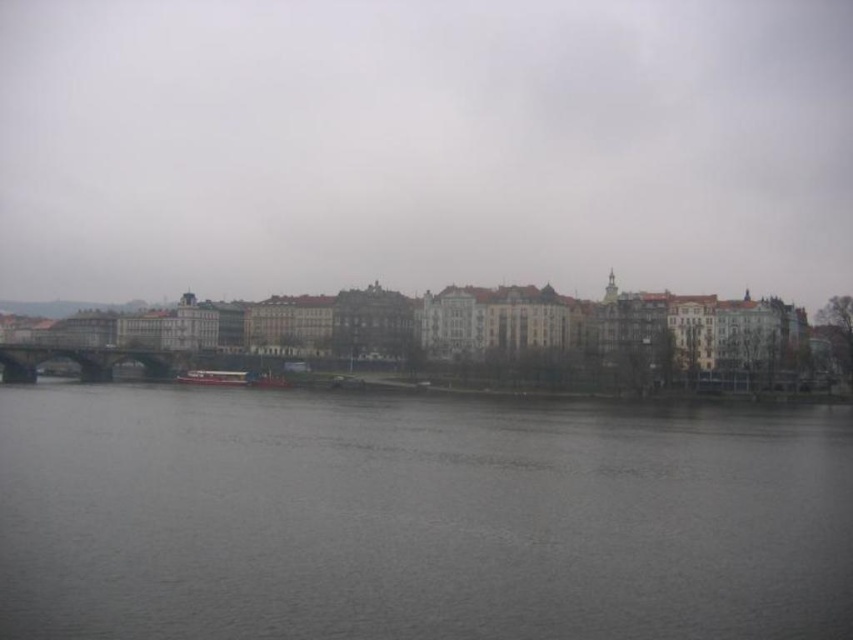
Question: Among these objects, which one is nearest to the camera?

Choices:
 (A) green stone bridge at center
 (B) matte gray buildings at center
 (C) gray water at center

Answer: (C)

Question: Is matte gray buildings at center positioned behind green stone bridge at center?

Choices:
 (A) no
 (B) yes

Answer: (A)

Question: Which point is closer to the camera taking this photo?

Choices:
 (A) pos(112,460)
 (B) pos(113,362)

Answer: (A)

Question: Is gray water at center above green stone bridge at center?

Choices:
 (A) yes
 (B) no

Answer: (B)

Question: Which of the following is the farthest from the observer?

Choices:
 (A) gray water at center
 (B) green stone bridge at center

Answer: (B)

Question: Does gray water at center have a lesser width compared to green stone bridge at center?

Choices:
 (A) no
 (B) yes

Answer: (A)